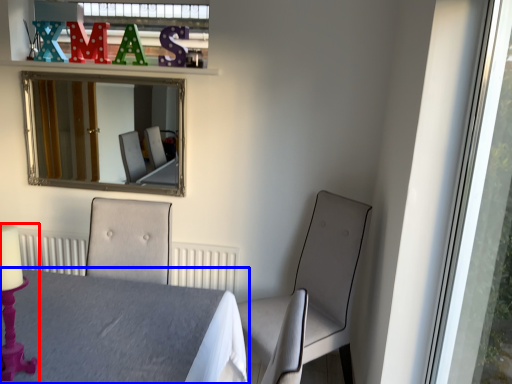
Question: Among these objects, which one is nearest to the camera, candle holder (highlighted by a red box) or table (highlighted by a blue box)?

Choices:
 (A) candle holder
 (B) table

Answer: (B)